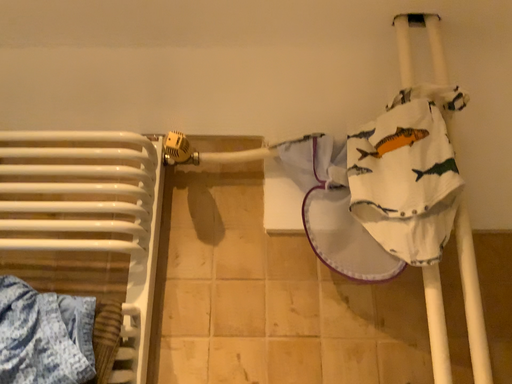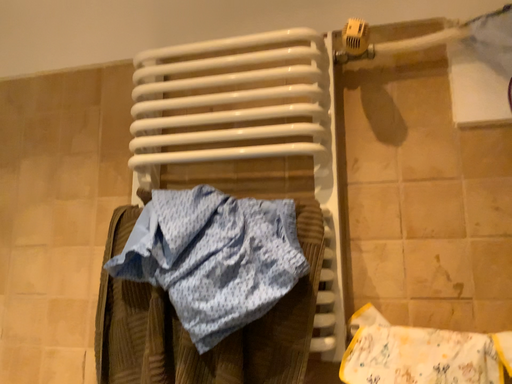
Question: Which way did the camera rotate in the video?

Choices:
 (A) rotated left
 (B) rotated right

Answer: (A)